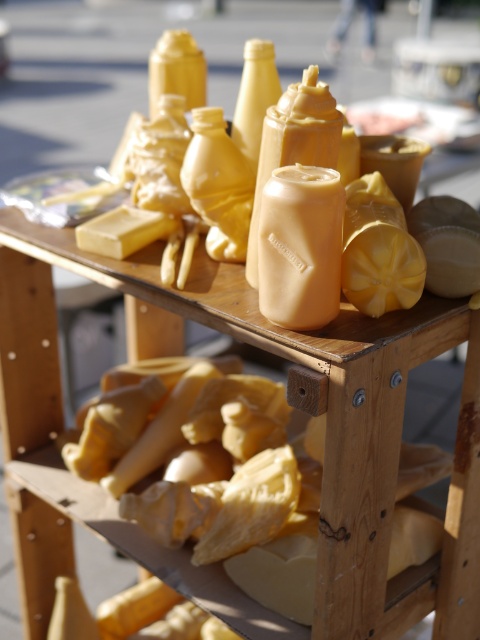
Is matte yellow cheese at center to the right of yellow wax block at center from the viewer's perspective?

Correct, you'll find matte yellow cheese at center to the right of yellow wax block at center.

Between point (64, 234) and point (79, 236), which one is positioned in front?

Point (79, 236)

Locate an element on the screen. This screenshot has height=640, width=480. matte yellow cheese at center is located at coordinates (296, 403).